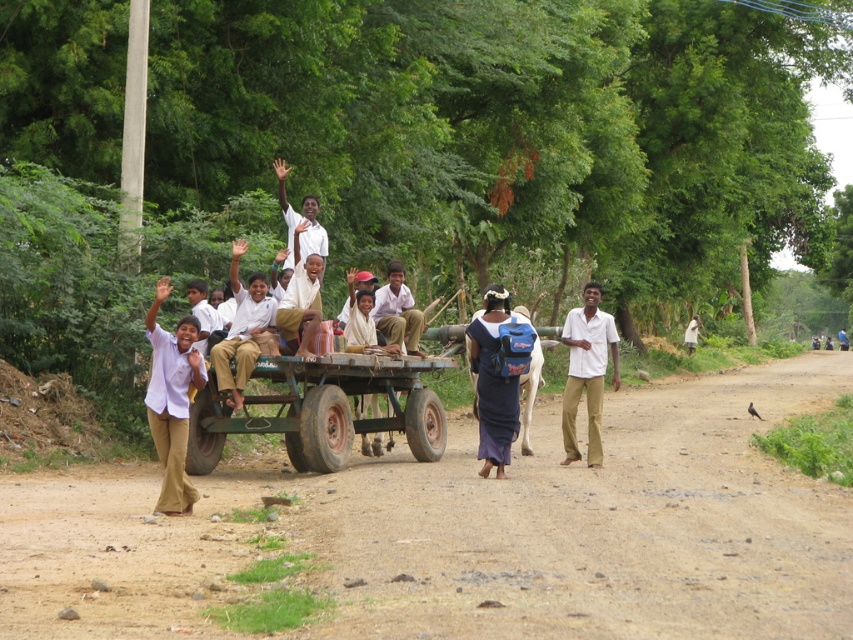
Question: Is rusty metal wagon at center smaller than white shirt at upper center?

Choices:
 (A) no
 (B) yes

Answer: (A)

Question: From the image, what is the correct spatial relationship of white cotton shirt at right in relation to matte white shirt at center?

Choices:
 (A) left
 (B) right

Answer: (B)

Question: Is matte white shirt at left thinner than light brown uniform at center?

Choices:
 (A) no
 (B) yes

Answer: (B)

Question: Among these objects, which one is farthest from the camera?

Choices:
 (A) rusty metal wagon at center
 (B) white cotton shirt at right

Answer: (B)

Question: Which of the following is the closest to the observer?

Choices:
 (A) (293, 216)
 (B) (409, 317)
 (C) (575, 401)
 (D) (252, 300)

Answer: (D)

Question: Which point appears closest to the camera in this image?

Choices:
 (A) (230, 376)
 (B) (251, 426)
 (C) (485, 396)
 (D) (314, 214)

Answer: (C)